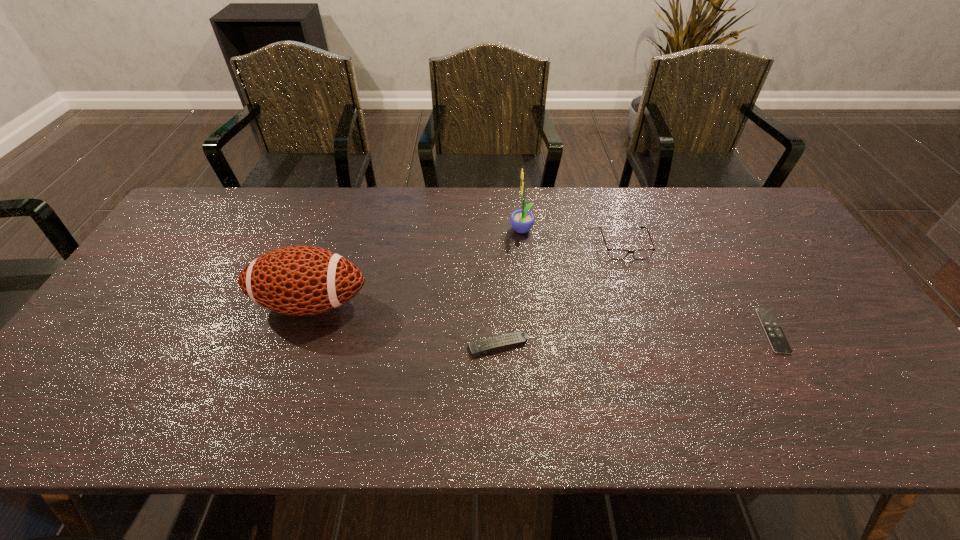
In the image, there is a desktop. Where is `vacant region at the left edge`? vacant region at the left edge is located at coordinates (106, 366).

I want to click on vacant point at the right edge, so click(x=815, y=341).

You are a GUI agent. You are given a task and a screenshot of the screen. Output one action in this format:
    pyautogui.click(x=<x>, y=<y>)
    Task: Click on the free space at the far right corner
    The image size is (960, 540).
    Given the screenshot: What is the action you would take?
    pyautogui.click(x=736, y=190)

Where is `free space between the tallest object and the football`? free space between the tallest object and the football is located at coordinates (417, 267).

This screenshot has height=540, width=960. What are the coordinates of `vacant area that lies between the sunflower and the shorter remote control` in the screenshot? It's located at (647, 281).

I want to click on vacant space that's between the fourth tallest object and the shortest object, so coord(636,338).

Identify the location of vacant space that's between the third tallest object and the sunflower. The height and width of the screenshot is (540, 960). (573, 238).

I want to click on free space between the fourth tallest object and the sunflower, so click(510, 288).

This screenshot has width=960, height=540. In order to click on free point between the spectacles and the tallest object in this screenshot , I will do `click(573, 238)`.

This screenshot has width=960, height=540. Find the location of `free space between the leftmost object and the sunflower`. free space between the leftmost object and the sunflower is located at coordinates (417, 267).